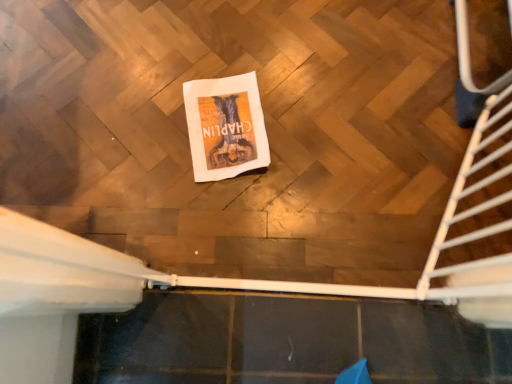
Identify the location of free region under white paper towel at center (from a real-world perspective). (224, 125).